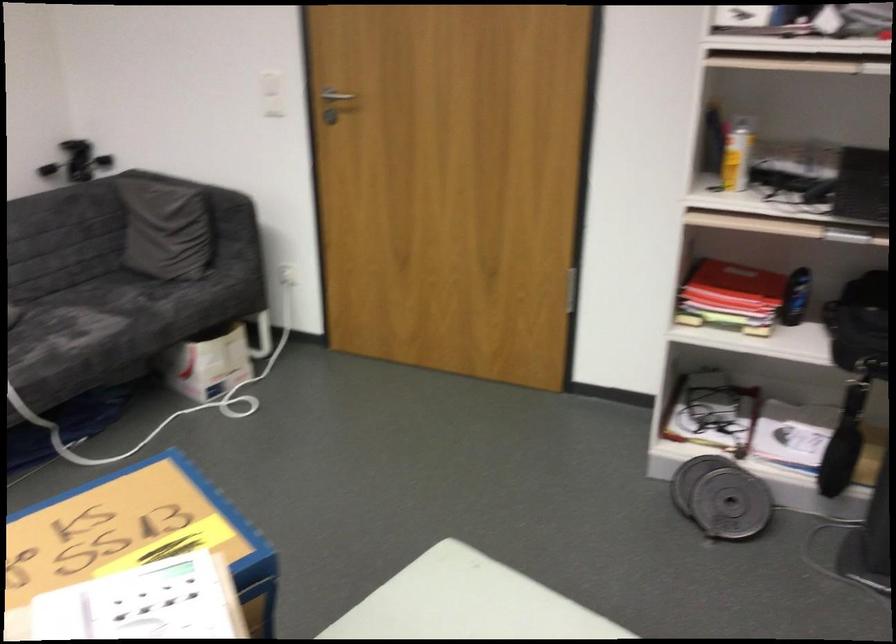
Find the location of `metal door handle`. metal door handle is located at coordinates (331, 98).